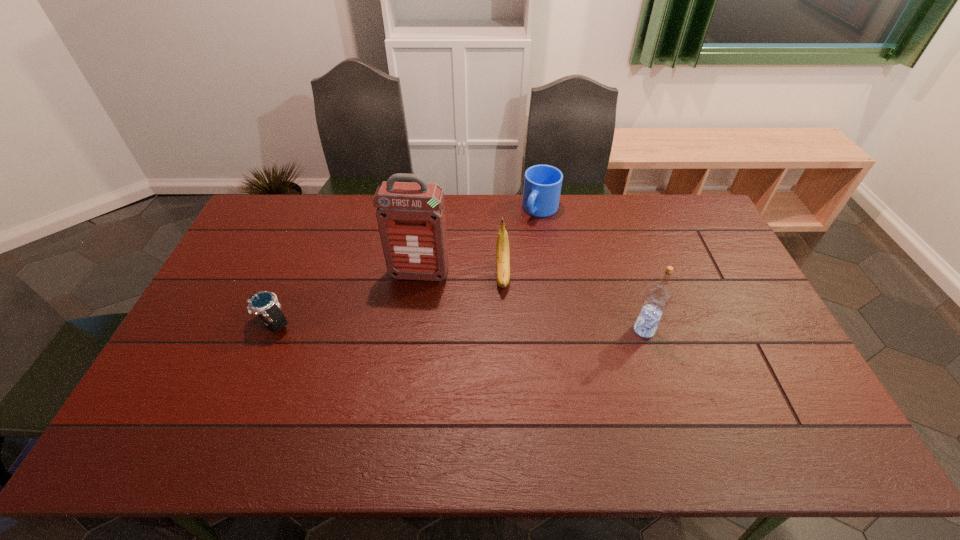
Identify the location of free space on the desktop that is between the watch and the rightmost object and is positioned on the side of the mug with the handle. (462, 327).

Locate an element on the screen. vacant space on the desktop that is between the shortest object and the rightmost object and is positioned at the start of the peel on the banana is located at coordinates click(505, 327).

Locate an element on the screen. vacant spot on the desktop that is between the watch and the second tallest object and is positioned on the front-facing side of the fourth object from right to left is located at coordinates (407, 326).